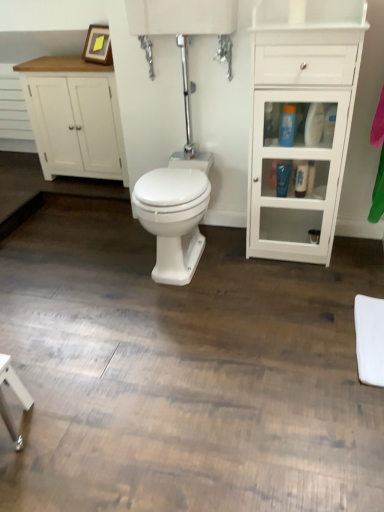
Identify the location of vacant space in between white glossy bidet at center and white glossy cabinet at right, which is counted as the 2th bathroom cabinet, starting from the back. (243, 267).